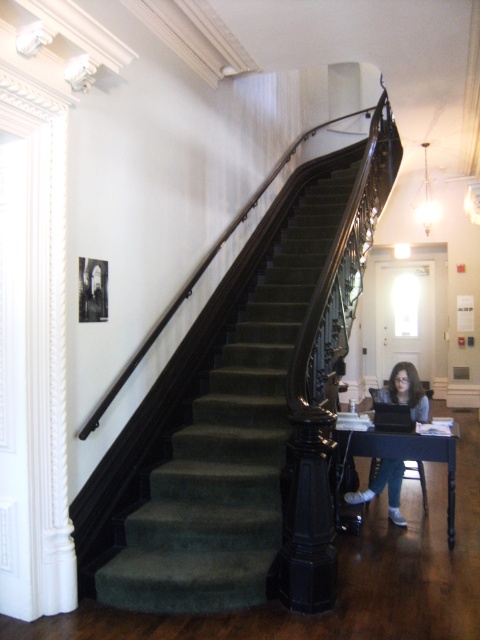
You are standing at the entrance of the grand staircase in the image. You need to place a small potted plant exactly at point [229,442]. Based on the scene description, where should you place the potted plant?

You should place the potted plant on the green velvet stairwell at center, as the point [229,442] is located there.

You are standing in the grand staircase area and want to place a small decorative item. You have two points marked on the wall at point coordinates point (176, 525) and point (414, 403). Which point is closer to you so that the decoration will be more visible?

Point (176, 525) is closer to the viewer than point (414, 403), so placing the decorative item there will make it more visible.

You are standing at the entrance of the grand staircase in the image. You notice a small table at the lower right corner of the scene. Can you determine if the point marked at coordinates (x=405, y=456) is located on that table?

The point marked at coordinates (x=405, y=456) is on the dark wood table at lower right, so yes, it is located on the table.